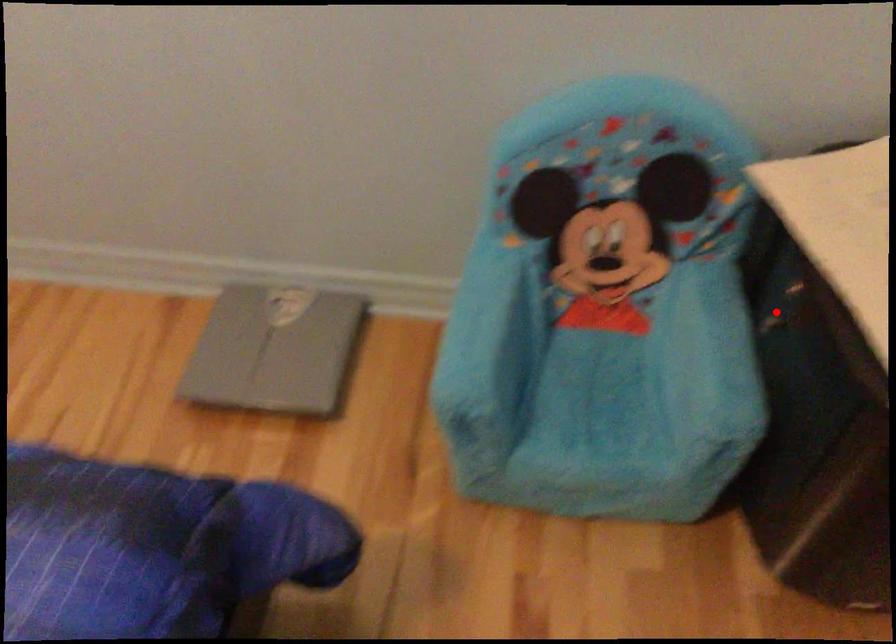
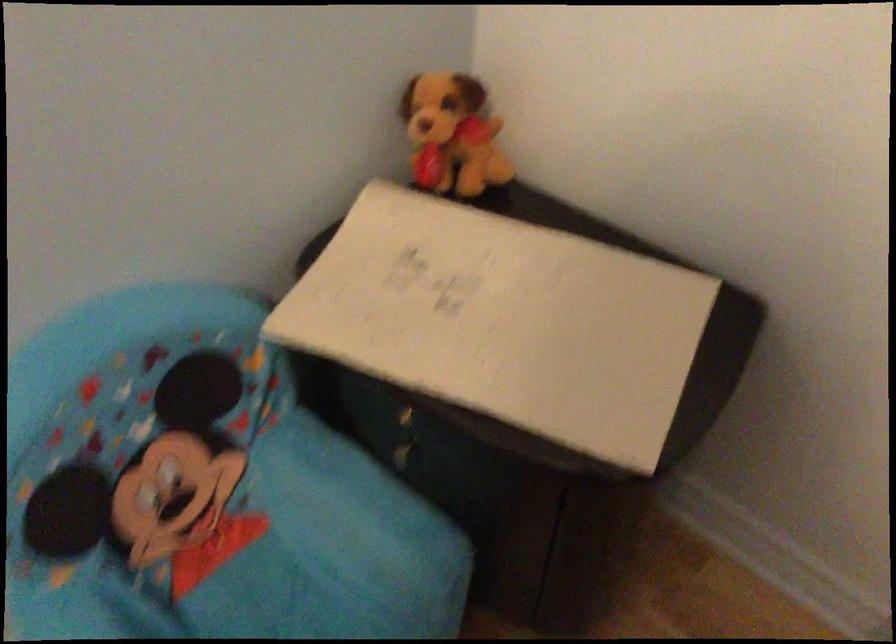
Find the pixel in the second image that matches the highlighted location in the first image.

(403, 438)